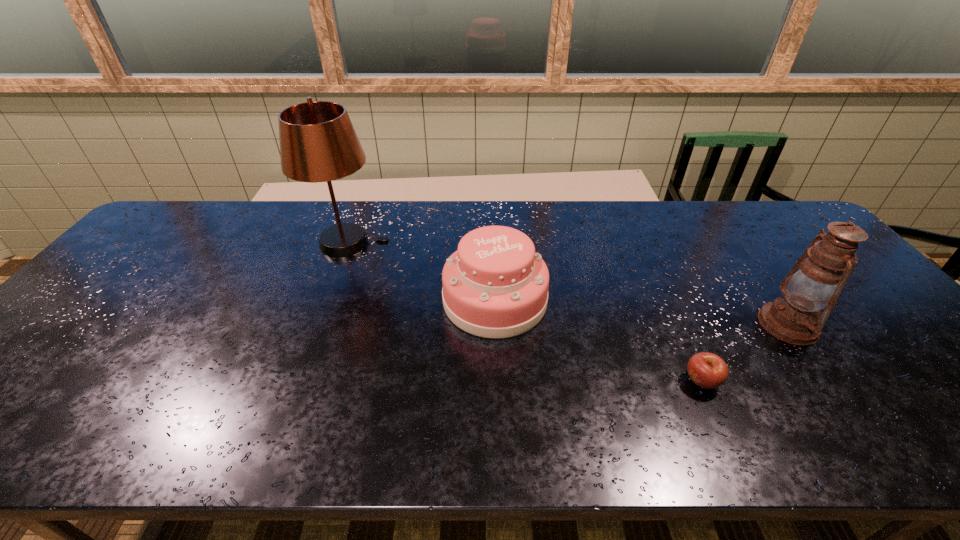
Identify the location of the tallest object. The image size is (960, 540). (318, 143).

You are a GUI agent. You are given a task and a screenshot of the screen. Output one action in this format:
    pyautogui.click(x=<x>, y=<y>)
    Task: Click on the leftmost object
    The image size is (960, 540).
    Given the screenshot: What is the action you would take?
    pyautogui.click(x=318, y=143)

At what (x,y) coordinates should I click in order to perform the action: click on the rightmost object. Please return your answer as a coordinate pair (x, y). Looking at the image, I should click on (825, 267).

Identify the location of oil lamp. (825, 267).

The width and height of the screenshot is (960, 540). Identify the location of the third object from right to left. (495, 286).

Where is `the third tallest object`? This screenshot has height=540, width=960. the third tallest object is located at coordinates [x=495, y=286].

The image size is (960, 540). I want to click on the nearest object, so (x=707, y=370).

The height and width of the screenshot is (540, 960). Find the location of `the shortest object`. the shortest object is located at coordinates (707, 370).

Where is `free region located on the front-facing side of the leftmost object`? The height and width of the screenshot is (540, 960). free region located on the front-facing side of the leftmost object is located at coordinates (483, 243).

Find the location of a particular element. vacant space located on the back of the oil lamp is located at coordinates (720, 230).